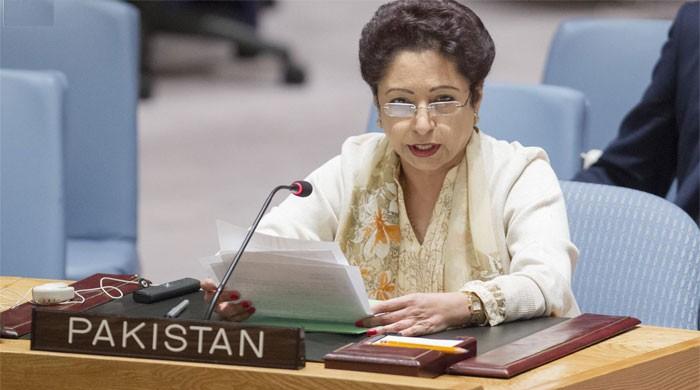
Image resolution: width=700 pixels, height=390 pixels. What are the coordinates of `papers` in the screenshot? It's located at point(309,292).